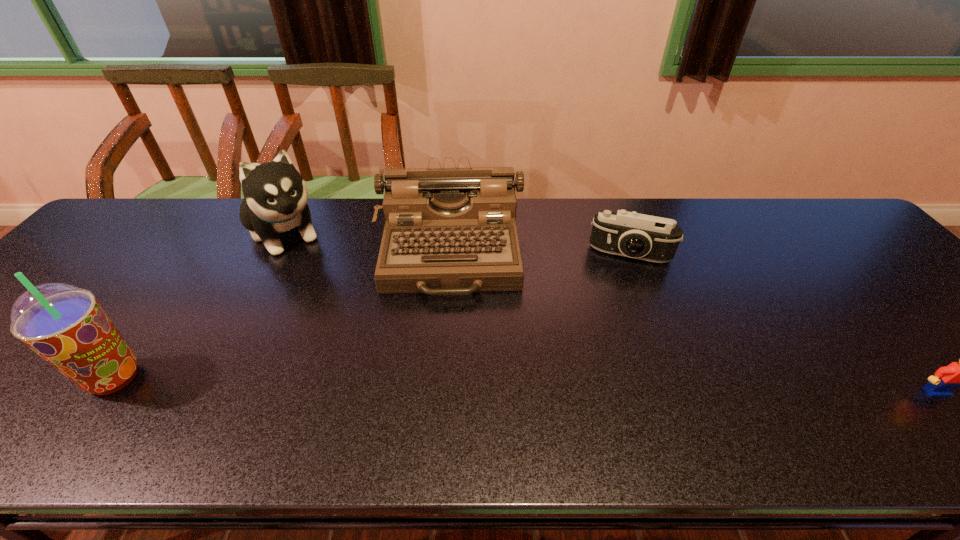
Locate an element on the screen. The width and height of the screenshot is (960, 540). free spot on the desktop that is between the leftmost object and the shortest object and is positioned on the front lens of the camera is located at coordinates (612, 386).

The height and width of the screenshot is (540, 960). Find the location of `free space on the desktop that is between the smoothie and the Lego and is positioned on the keyboard of the third object from right to left`. free space on the desktop that is between the smoothie and the Lego and is positioned on the keyboard of the third object from right to left is located at coordinates (445, 383).

Locate an element on the screen. The image size is (960, 540). vacant space on the desktop that is between the smoothie and the Lego and is positioned at the face of the puppy is located at coordinates (398, 383).